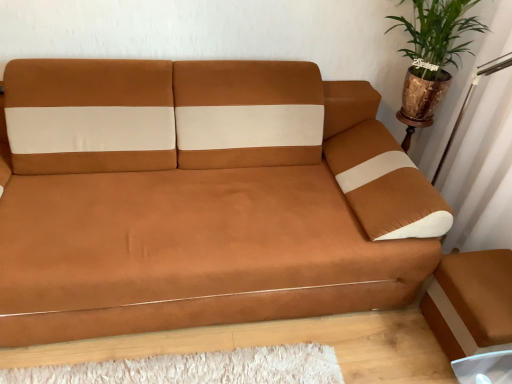
Locate an element on the screen. The width and height of the screenshot is (512, 384). brown leather couch at center is located at coordinates (201, 198).

Describe the element at coordinates (201, 198) in the screenshot. I see `brown leather couch at center` at that location.

At what (x,y) coordinates should I click in order to perform the action: click on green leafy plant in metallic pot at upper right. Please return your answer as a coordinate pair (x, y). Looking at the image, I should click on (433, 53).

What do you see at coordinates (433, 53) in the screenshot? This screenshot has height=384, width=512. I see `green leafy plant in metallic pot at upper right` at bounding box center [433, 53].

At what (x,y) coordinates should I click in order to perform the action: click on brown leather couch at center. Please return your answer as a coordinate pair (x, y). The image size is (512, 384). Looking at the image, I should click on (201, 198).

Which is more to the left, brown leather couch at center or green leafy plant in metallic pot at upper right?

From the viewer's perspective, brown leather couch at center appears more on the left side.

In the image, is brown leather couch at center positioned in front of or behind green leafy plant in metallic pot at upper right?

Clearly, brown leather couch at center is in front of green leafy plant in metallic pot at upper right.

Does point (105, 110) come behind point (403, 90)?

No, (105, 110) is closer to viewer.

From the image's perspective, who appears lower, brown leather couch at center or green leafy plant in metallic pot at upper right?

From the image's view, brown leather couch at center is below.

From a real-world perspective, is brown leather couch at center under green leafy plant in metallic pot at upper right?

Indeed, from a real-world perspective, brown leather couch at center is positioned beneath green leafy plant in metallic pot at upper right.

Is brown leather couch at center wider than green leafy plant in metallic pot at upper right?

Correct, the width of brown leather couch at center exceeds that of green leafy plant in metallic pot at upper right.

Does brown leather couch at center have a lesser height compared to green leafy plant in metallic pot at upper right?

Incorrect, the height of brown leather couch at center does not fall short of that of green leafy plant in metallic pot at upper right.

Between brown leather couch at center and green leafy plant in metallic pot at upper right, which one has larger size?

brown leather couch at center is bigger.

Is brown leather couch at center not inside green leafy plant in metallic pot at upper right?

Absolutely, brown leather couch at center is external to green leafy plant in metallic pot at upper right.

Is brown leather couch at center positioned far away from green leafy plant in metallic pot at upper right?

They are positioned close to each other.

Is brown leather couch at center oriented away from green leafy plant in metallic pot at upper right?

No, brown leather couch at center is not facing the opposite direction of green leafy plant in metallic pot at upper right.

Can you tell me how much brown leather couch at center and green leafy plant in metallic pot at upper right differ in facing direction?

There is a 1.44-degree angle between the facing directions of brown leather couch at center and green leafy plant in metallic pot at upper right.

How much distance is there between brown leather couch at center and green leafy plant in metallic pot at upper right?

brown leather couch at center is 32.19 inches away from green leafy plant in metallic pot at upper right.

You are a GUI agent. You are given a task and a screenshot of the screen. Output one action in this format:
    pyautogui.click(x=<x>, y=<y>)
    Task: Click on the houseplant on the right of the brown leather couch at center
    The width and height of the screenshot is (512, 384).
    Given the screenshot: What is the action you would take?
    point(433,53)

Between green leafy plant in metallic pot at upper right and brown leather couch at center, which one appears on the left side from the viewer's perspective?

brown leather couch at center is more to the left.

Is green leafy plant in metallic pot at upper right behind brown leather couch at center?

Yes, the depth of green leafy plant in metallic pot at upper right is greater than that of brown leather couch at center.

Does point (473, 27) appear closer or farther from the camera than point (276, 64)?

Point (473, 27).

In the scene shown: From the image's perspective, is green leafy plant in metallic pot at upper right positioned above or below brown leather couch at center?

green leafy plant in metallic pot at upper right is above brown leather couch at center.

From a real-world perspective, relative to brown leather couch at center, is green leafy plant in metallic pot at upper right vertically above or below?

green leafy plant in metallic pot at upper right is above brown leather couch at center.

Considering the sizes of objects green leafy plant in metallic pot at upper right and brown leather couch at center in the image provided, who is thinner, green leafy plant in metallic pot at upper right or brown leather couch at center?

With smaller width is green leafy plant in metallic pot at upper right.

Who is taller, green leafy plant in metallic pot at upper right or brown leather couch at center?

Standing taller between the two is brown leather couch at center.

Considering the sizes of objects green leafy plant in metallic pot at upper right and brown leather couch at center in the image provided, who is smaller, green leafy plant in metallic pot at upper right or brown leather couch at center?

green leafy plant in metallic pot at upper right.

Is green leafy plant in metallic pot at upper right not within brown leather couch at center?

green leafy plant in metallic pot at upper right lies outside brown leather couch at center's area.

Would you say green leafy plant in metallic pot at upper right is a long distance from brown leather couch at center?

That's not correct — green leafy plant in metallic pot at upper right is a little close to brown leather couch at center.

Is green leafy plant in metallic pot at upper right oriented away from brown leather couch at center?

No, green leafy plant in metallic pot at upper right's orientation is not away from brown leather couch at center.

Can you tell me how much green leafy plant in metallic pot at upper right and brown leather couch at center differ in facing direction?

The facing directions of green leafy plant in metallic pot at upper right and brown leather couch at center are 1.44 degrees apart.

Locate an element on the screen. Image resolution: width=512 pixels, height=384 pixels. houseplant above the brown leather couch at center (from the image's perspective) is located at coordinates (433, 53).

Where is `houseplant located behind the brown leather couch at center`? houseplant located behind the brown leather couch at center is located at coordinates (433, 53).

Locate an element on the screen. houseplant above the brown leather couch at center (from a real-world perspective) is located at coordinates (433, 53).